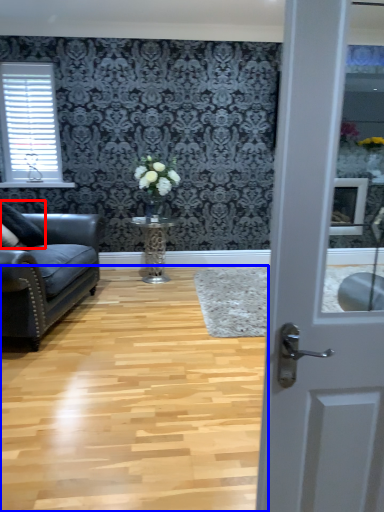
Question: Which object is closer to the camera taking this photo, pillow (highlighted by a red box) or plain (highlighted by a blue box)?

Choices:
 (A) pillow
 (B) plain

Answer: (B)